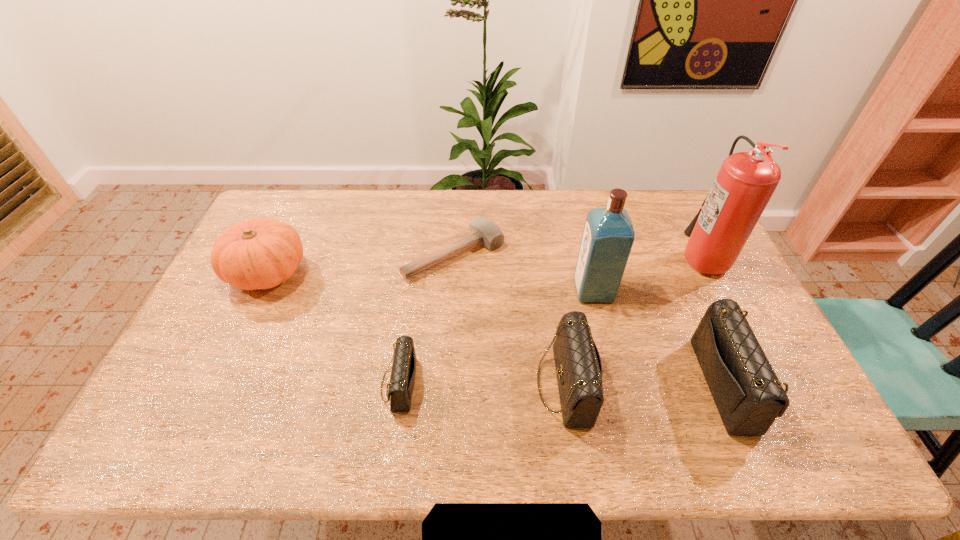
You are a GUI agent. You are given a task and a screenshot of the screen. Output one action in this format:
    pyautogui.click(x=<x>, y=<y>)
    Task: Click on the blank area located 0.150m on the flat label side of the second tallest object
    The height and width of the screenshot is (540, 960).
    Given the screenshot: What is the action you would take?
    pyautogui.click(x=526, y=291)

Locate an element on the screen. free region located on the flat label side of the second tallest object is located at coordinates (485, 291).

Find the location of a particular element. This screenshot has height=540, width=960. free location located 0.120m on the flat label side of the second tallest object is located at coordinates (537, 291).

The image size is (960, 540). Find the location of `free space located on the right of the leftmost object`. free space located on the right of the leftmost object is located at coordinates (383, 272).

This screenshot has height=540, width=960. In order to click on fire extinguisher situated at the far edge in this screenshot , I will do `click(746, 181)`.

Locate an element on the screen. mallet at the far edge is located at coordinates (483, 231).

Locate an element on the screen. Image resolution: width=960 pixels, height=540 pixels. object located in the left edge section of the desktop is located at coordinates (262, 253).

Where is `clutch bag situated at the right edge`? This screenshot has width=960, height=540. clutch bag situated at the right edge is located at coordinates (749, 397).

Where is `fire extinguisher located in the right edge section of the desktop`? fire extinguisher located in the right edge section of the desktop is located at coordinates (746, 181).

The image size is (960, 540). I want to click on object located at the far right corner, so click(x=746, y=181).